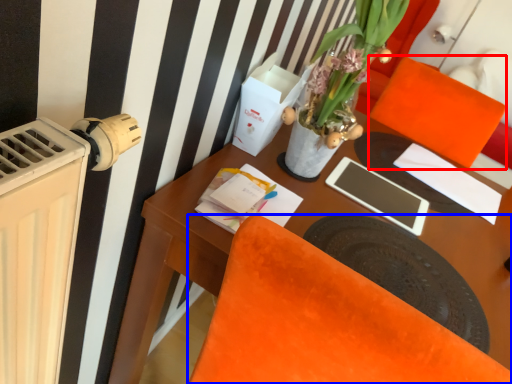
Question: Which of the following is the farthest to the observer, armchair (highlighted by a red box) or chair (highlighted by a blue box)?

Choices:
 (A) armchair
 (B) chair

Answer: (A)